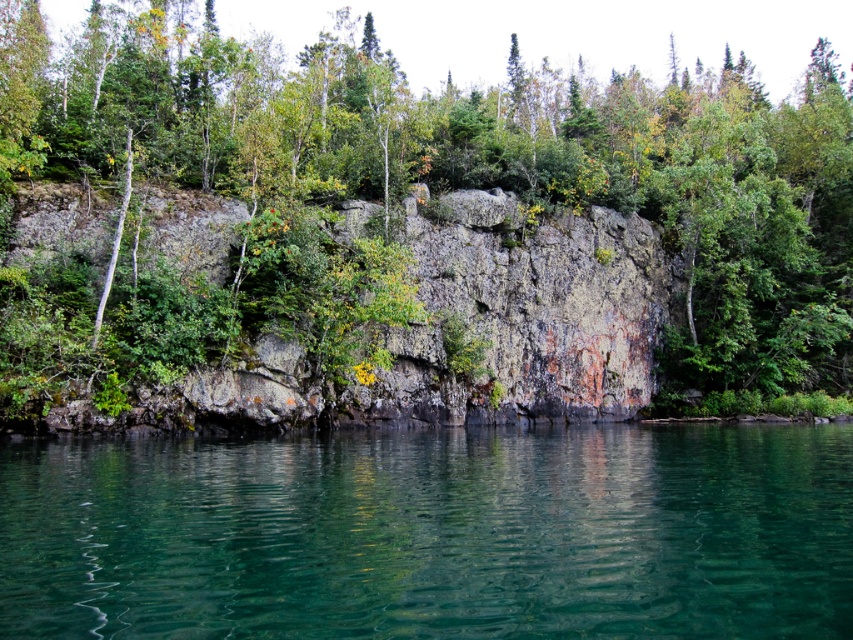
Does green leafy tree at upper center appear on the left side of rusty stone cliff at center?

In fact, green leafy tree at upper center is to the right of rusty stone cliff at center.

How distant is green leafy tree at upper center from rusty stone cliff at center?

green leafy tree at upper center and rusty stone cliff at center are 25.54 meters apart from each other.

What do you see at coordinates (410, 189) in the screenshot? The image size is (853, 640). I see `green leafy tree at upper center` at bounding box center [410, 189].

Where is `green leafy tree at upper center`? The width and height of the screenshot is (853, 640). green leafy tree at upper center is located at coordinates (410, 189).

Does clear glass water at center appear over rusty stone cliff at center?

Incorrect, clear glass water at center is not positioned above rusty stone cliff at center.

Based on the photo, is the position of clear glass water at center less distant than that of rusty stone cliff at center?

Yes, it is.

The width and height of the screenshot is (853, 640). Find the location of `clear glass water at center`. clear glass water at center is located at coordinates (432, 532).

In the scene shown: Can you confirm if green leafy tree at upper center is bigger than clear glass water at center?

Correct, green leafy tree at upper center is larger in size than clear glass water at center.

Between green leafy tree at upper center and clear glass water at center, which one appears on the left side from the viewer's perspective?

clear glass water at center

Locate an element on the screen. green leafy tree at upper center is located at coordinates (410, 189).

At what (x,y) coordinates should I click in order to perform the action: click on green leafy tree at upper center. Please return your answer as a coordinate pair (x, y). Looking at the image, I should click on (410, 189).